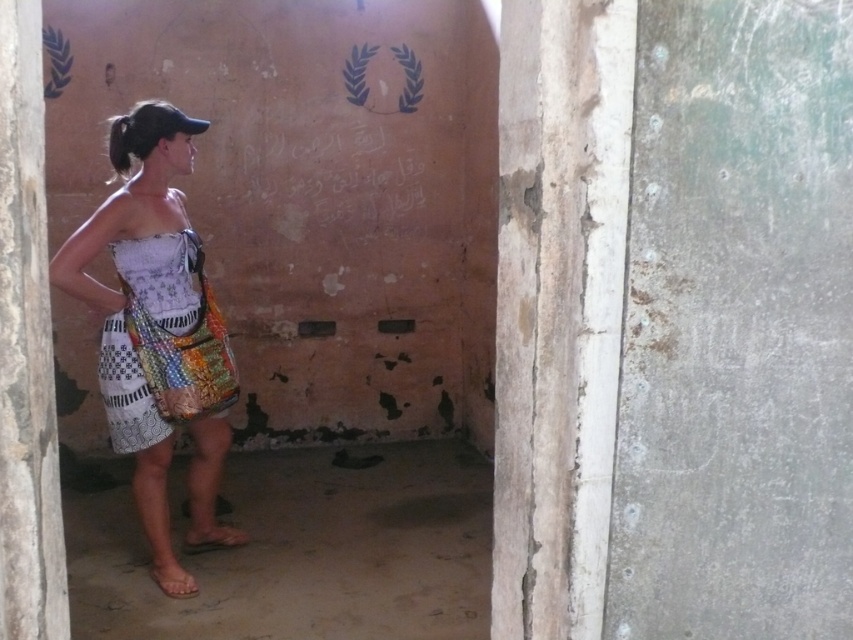
Between white patchwork dress at center and brown leather sandal at lower left, which one has more height?

With more height is white patchwork dress at center.

Which is behind, point (128, 280) or point (235, 540)?

Positioned behind is point (235, 540).

The width and height of the screenshot is (853, 640). Find the location of `white patchwork dress at center`. white patchwork dress at center is located at coordinates (155, 323).

Is bright multicolored fabric bag at left thinner than brown fabric sandal at lower left?

No, bright multicolored fabric bag at left is not thinner than brown fabric sandal at lower left.

The width and height of the screenshot is (853, 640). What do you see at coordinates (161, 342) in the screenshot?
I see `bright multicolored fabric bag at left` at bounding box center [161, 342].

I want to click on bright multicolored fabric bag at left, so click(161, 342).

Who is lower down, brown leather sandal at lower left or brown fabric sandal at lower left?

brown fabric sandal at lower left is lower down.

Can you confirm if brown leather sandal at lower left is positioned to the left of brown fabric sandal at lower left?

No, brown leather sandal at lower left is not to the left of brown fabric sandal at lower left.

What do you see at coordinates (213, 538) in the screenshot? The image size is (853, 640). I see `brown leather sandal at lower left` at bounding box center [213, 538].

Where is `brown leather sandal at lower left`? This screenshot has height=640, width=853. brown leather sandal at lower left is located at coordinates (213, 538).